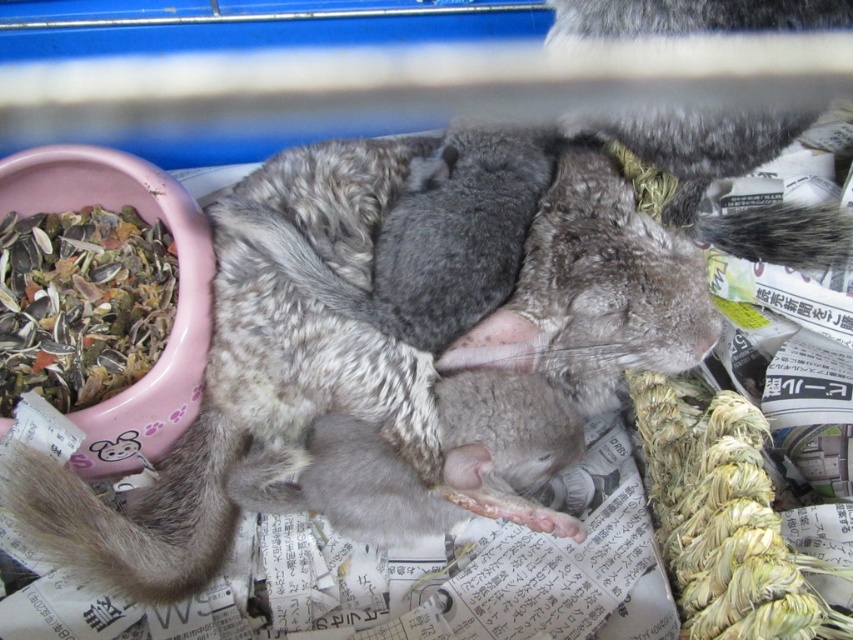
Question: In this image, where is multicolored grain mix at left located relative to fuzzy gray tail at lower left?

Choices:
 (A) above
 (B) below

Answer: (A)

Question: Among these objects, which one is nearest to the camera?

Choices:
 (A) gray fluffy tail at upper right
 (B) multicolored grain mix at left

Answer: (B)

Question: Can you confirm if multicolored grain mix at left is thinner than fuzzy gray tail at lower left?

Choices:
 (A) no
 (B) yes

Answer: (A)

Question: Estimate the real-world distances between objects in this image. Which object is farther from the fuzzy gray tail at lower left?

Choices:
 (A) multicolored grain mix at left
 (B) gray fluffy tail at upper right

Answer: (B)

Question: Which of these objects is positioned farthest from the gray fluffy tail at upper right?

Choices:
 (A) fuzzy gray tail at lower left
 (B) multicolored grain mix at left

Answer: (B)

Question: Does multicolored grain mix at left appear on the right side of fuzzy gray tail at lower left?

Choices:
 (A) no
 (B) yes

Answer: (A)